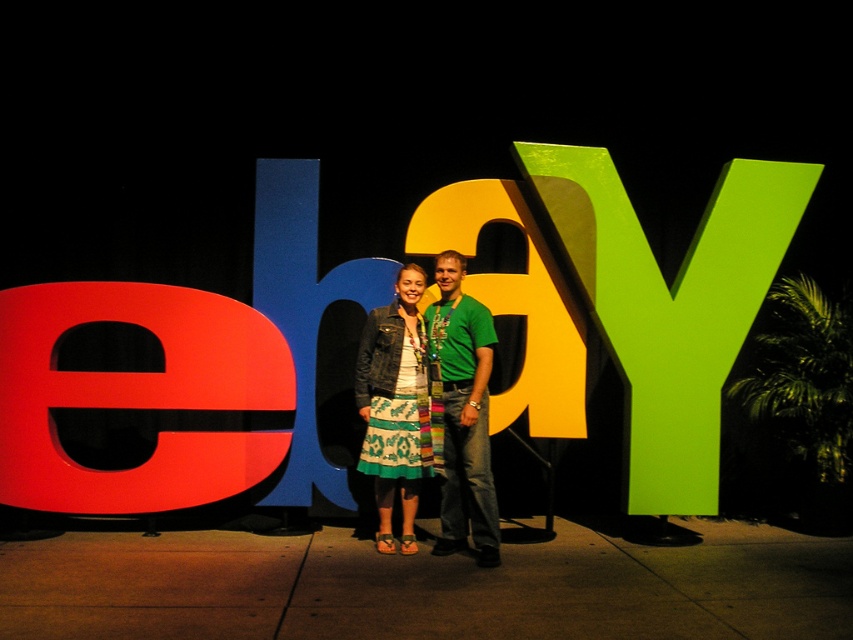
Question: Where is green glossy y at center right located in relation to green textured shirt at center in the image?

Choices:
 (A) right
 (B) left

Answer: (A)

Question: Observing the image, what is the correct spatial positioning of green glossy y at center right in reference to matte red letter e at left?

Choices:
 (A) right
 (B) left

Answer: (A)

Question: Is matte red letter e at left above matte yellow letter at center?

Choices:
 (A) no
 (B) yes

Answer: (A)

Question: Considering the real-world distances, which object is closest to the green textured shirt at center?

Choices:
 (A) matte yellow letter at center
 (B) matte red letter e at left

Answer: (A)

Question: Among these objects, which one is farthest from the camera?

Choices:
 (A) green textured shirt at center
 (B) matte red letter e at left
 (C) green glossy y at center right
 (D) denim jacket at center

Answer: (C)

Question: Which object is the closest to the denim jacket at center?

Choices:
 (A) green textured shirt at center
 (B) green glossy y at center right
 (C) matte yellow letter at center

Answer: (A)